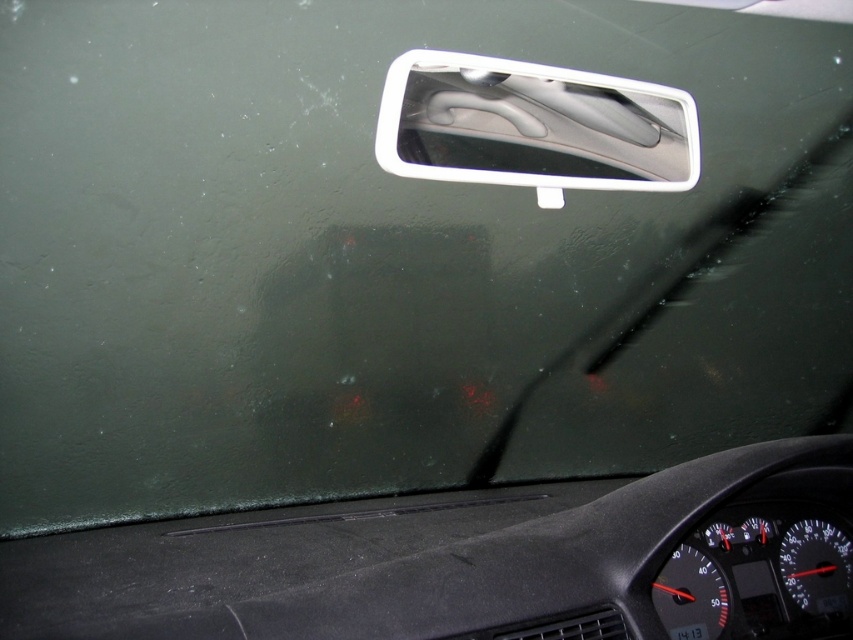
You are a delivery driver who needs to attach a GPS tracker to your car. The GPS tracker is 2 feet wide. You have two options to place it either on the white plastic car mirror at upper center or on the white plastic license plate at center. Based on the distance between them, can you fit the GPS tracker on either of these two objects without overlapping?

The white plastic car mirror at upper center is 3.67 feet away from the white plastic license plate at center. Since the GPS tracker is only 2 feet wide, it can fit on either object without overlapping as the distance between them is greater than the tracker size.

You are a car mechanic checking the windshield from inside the car. You notice the white plastic car mirror at upper center and the white plastic license plate at center. Which object is taller?

The white plastic car mirror at upper center is taller than the white plastic license plate at center according to the description.

You are a car mechanic inspecting the interior of a car. You notice the white plastic car mirror at upper center and the white plastic license plate at center. Which object is larger in size?

The white plastic car mirror at upper center is bigger than the white plastic license plate at center.